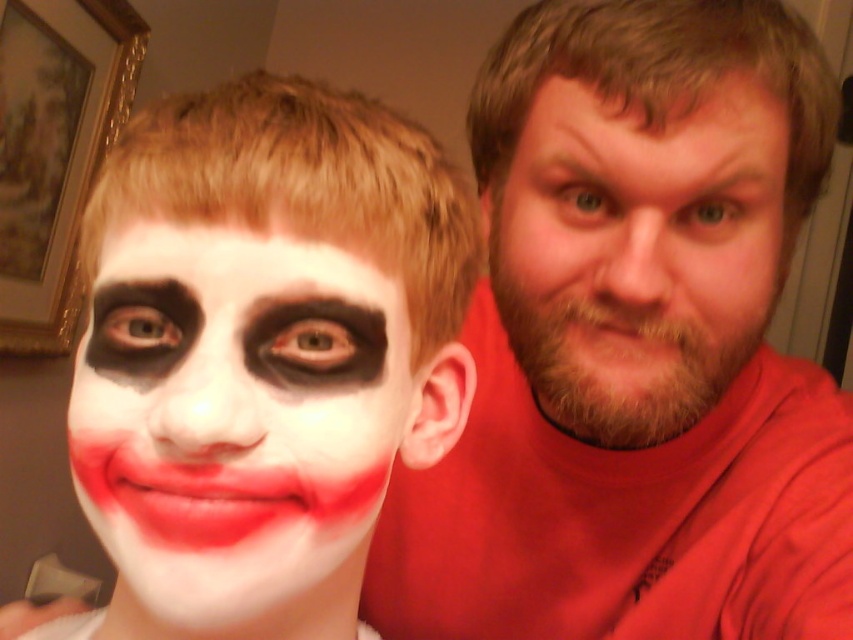
Can you confirm if white matte face paint at center is thinner than bearded man at right?

Yes.

Between white matte face paint at center and bearded man at right, which one has less height?

Standing shorter between the two is white matte face paint at center.

Is point (180, 516) less distant than point (733, 282)?

Yes, it is.

Identify the location of white matte face paint at center. The height and width of the screenshot is (640, 853). pos(236,428).

Between point (718, 602) and point (643, 401), which one is positioned behind?

The point (718, 602) is more distant.

Locate an element on the screen. smooth red shirt at right is located at coordinates (635, 346).

Image resolution: width=853 pixels, height=640 pixels. Find the location of `smooth red shirt at right`. smooth red shirt at right is located at coordinates (635, 346).

Identify the location of smooth red shirt at right. (635, 346).

You are a GUI agent. You are given a task and a screenshot of the screen. Output one action in this format:
    pyautogui.click(x=<x>, y=<y>)
    Task: Click on the smooth red shirt at right
    The width and height of the screenshot is (853, 640).
    Given the screenshot: What is the action you would take?
    pyautogui.click(x=635, y=346)